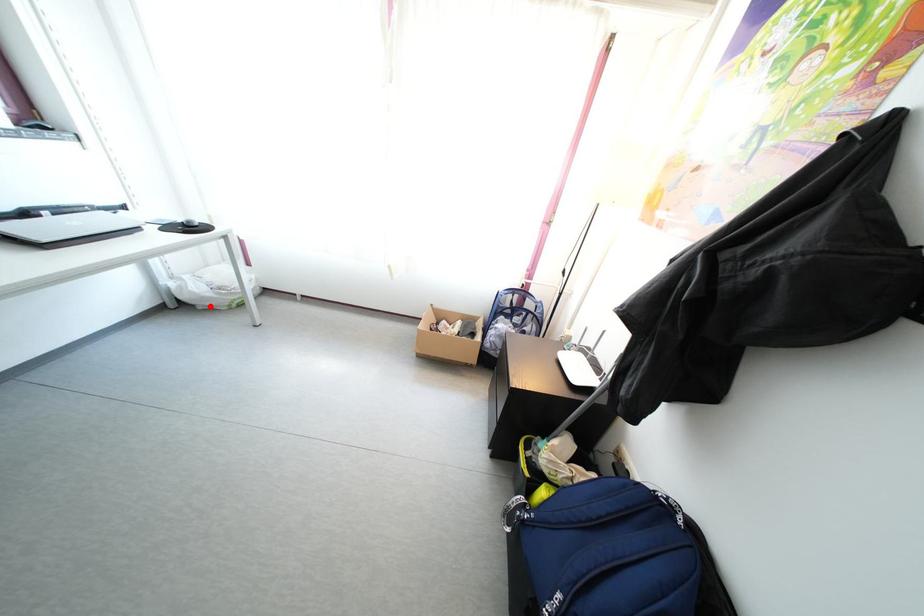
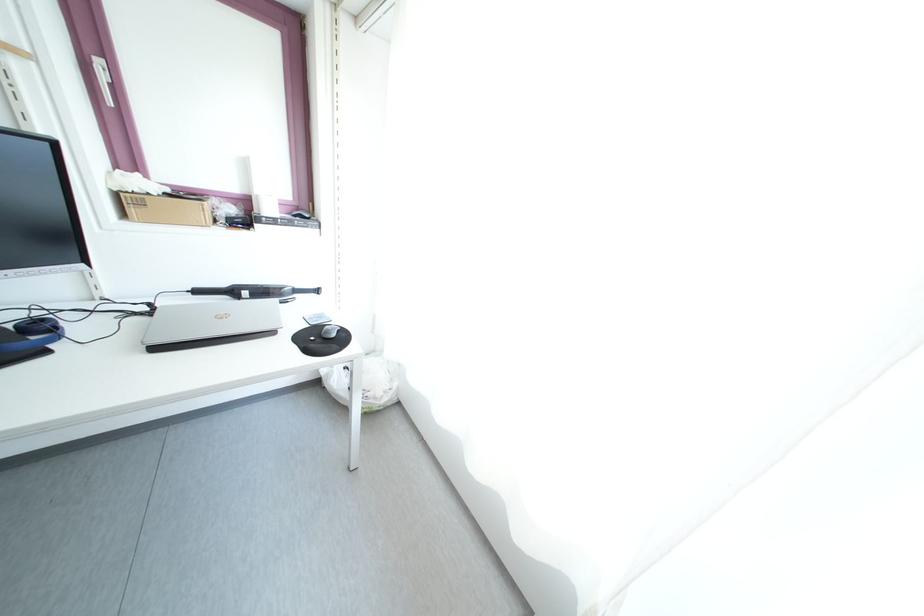
Question: I am providing you with two images of the same scene from different viewpoints. In image1, a red point is highlighted. Considering the same 3D point in image2, which of the following is correct?

Choices:
 (A) It is closer
 (B) It is farther

Answer: (B)